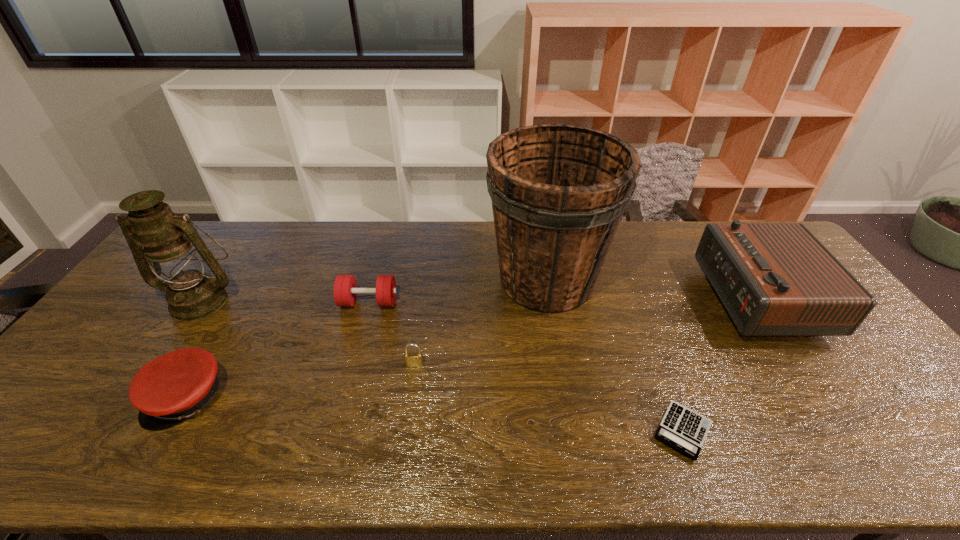
Point out which object is positioned as the sixth nearest to the bucket. Please provide its 2D coordinates. Your answer should be formatted as a tuple, i.e. [(x, y)], where the tuple contains the x and y coordinates of a point satisfying the conditions above.

[(172, 245)]

Identify the location of blank space that satisfies the following two spatial constraints: 1. on the front panel of the third tallest object; 2. at the front of the cap where the visor is located. (826, 397).